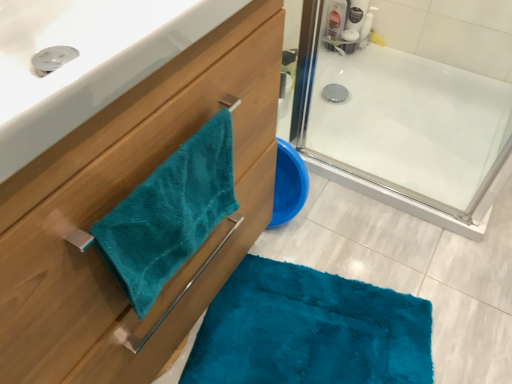
Question: Considering the positions of teal plush towel at left and translucent plastic bottle at upper right in the image, is teal plush towel at left wider or thinner than translucent plastic bottle at upper right?

Choices:
 (A) wide
 (B) thin

Answer: (B)

Question: From a real-world perspective, is teal plush towel at left above or below translucent plastic bottle at upper right?

Choices:
 (A) below
 (B) above

Answer: (B)

Question: Considering the real-world distances, which object is farthest from the teal plush towel at left?

Choices:
 (A) teal plush towel at left
 (B) translucent plastic bottle at upper right

Answer: (B)

Question: Estimate the real-world distances between objects in this image. Which object is closer to the teal plush towel at left?

Choices:
 (A) translucent plastic bottle at upper right
 (B) teal plush towel at left

Answer: (B)